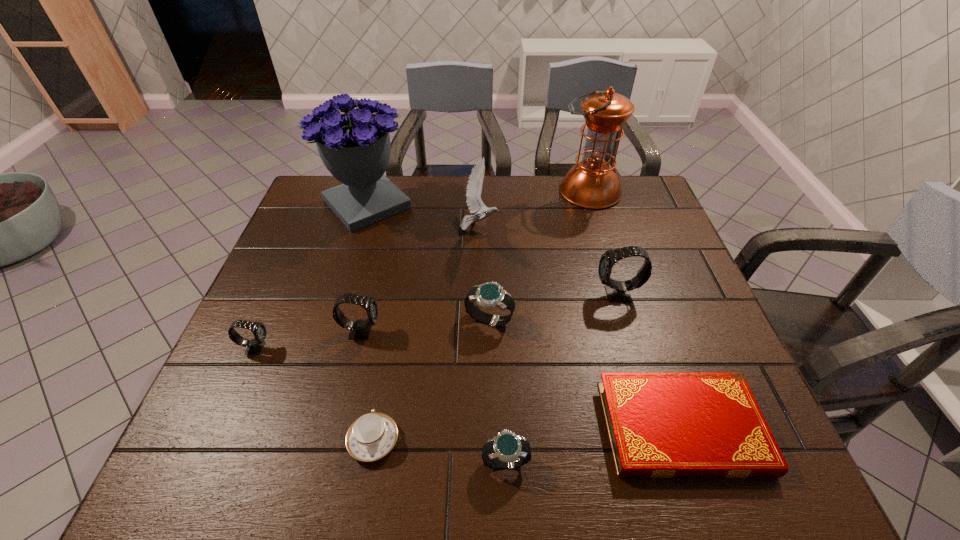
Locate an element on the screen. This screenshot has height=540, width=960. the smaller silver watch is located at coordinates (507, 450).

Locate an element on the screen. the nearer silver watch is located at coordinates (507, 450).

Locate an element on the screen. blue teacup is located at coordinates (372, 436).

Image resolution: width=960 pixels, height=540 pixels. What are the coordinates of `teacup` in the screenshot? It's located at (372, 436).

Where is `the shortest object`? The height and width of the screenshot is (540, 960). the shortest object is located at coordinates (661, 425).

What are the coordinates of `free space located 0.280m on the front of the oil lamp` in the screenshot? It's located at (614, 272).

Identify the location of vacant region located on the right of the bouquet. (521, 204).

Locate an element on the screen. free location located 0.380m at the tip of the beak of the white gull is located at coordinates (627, 228).

Image resolution: width=960 pixels, height=540 pixels. What are the coordinates of `vacant space located on the face of the farthest gray watch` in the screenshot? It's located at (537, 294).

Identify the location of vacant space located on the face of the farthest gray watch. The height and width of the screenshot is (540, 960). (444, 294).